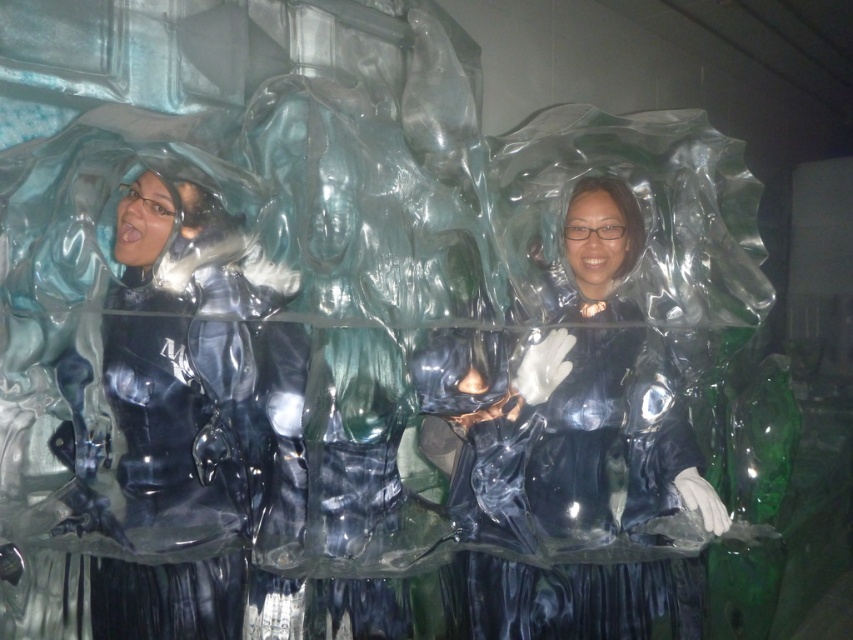
Is transparent plastic person at center to the right of transparent plastic figure at left from the viewer's perspective?

Indeed, transparent plastic person at center is positioned on the right side of transparent plastic figure at left.

This screenshot has height=640, width=853. What do you see at coordinates (578, 496) in the screenshot?
I see `transparent plastic person at center` at bounding box center [578, 496].

Does point (659, 380) come farther from viewer compared to point (235, 227)?

Yes, point (659, 380) is behind point (235, 227).

Find the location of a particular element. transparent plastic person at center is located at coordinates point(578,496).